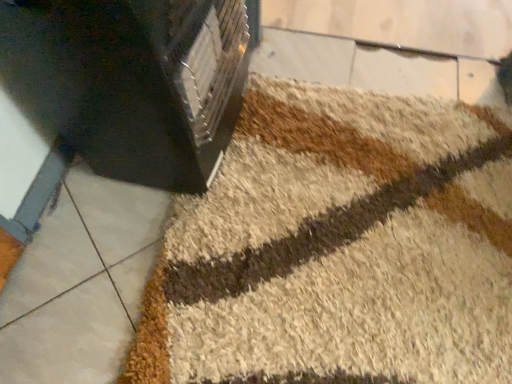
This screenshot has height=384, width=512. In order to click on black plastic heater at upper left in this screenshot , I will do `click(140, 80)`.

Consider the image. Measure the distance between black plastic heater at upper left and camera.

The depth of black plastic heater at upper left is 23.78 inches.

What do you see at coordinates (140, 80) in the screenshot? I see `black plastic heater at upper left` at bounding box center [140, 80].

Describe the element at coordinates (339, 248) in the screenshot. The height and width of the screenshot is (384, 512). I see `beige shaggy bath mat at center` at that location.

The image size is (512, 384). What are the coordinates of `beige shaggy bath mat at center` in the screenshot? It's located at (339, 248).

Find the location of a particular element. The height and width of the screenshot is (384, 512). black plastic heater at upper left is located at coordinates (140, 80).

Between black plastic heater at upper left and beige shaggy bath mat at center, which one appears on the right side from the viewer's perspective?

Positioned to the right is beige shaggy bath mat at center.

Is black plastic heater at upper left in front of beige shaggy bath mat at center?

Yes, it is in front of beige shaggy bath mat at center.

Which is closer to the camera, (169, 163) or (201, 342)?

The point (201, 342) is closer to the camera.

From the image's perspective, relative to beige shaggy bath mat at center, is black plastic heater at upper left above or below?

black plastic heater at upper left is above beige shaggy bath mat at center.

From a real-world perspective, is black plastic heater at upper left above or below beige shaggy bath mat at center?

In terms of real-world spatial position, black plastic heater at upper left is above beige shaggy bath mat at center.

Looking at this image, considering the relative sizes of black plastic heater at upper left and beige shaggy bath mat at center in the image provided, is black plastic heater at upper left thinner than beige shaggy bath mat at center?

Correct, the width of black plastic heater at upper left is less than that of beige shaggy bath mat at center.

Can you confirm if black plastic heater at upper left is shorter than beige shaggy bath mat at center?

No.

Does black plastic heater at upper left have a smaller size compared to beige shaggy bath mat at center?

Actually, black plastic heater at upper left might be larger than beige shaggy bath mat at center.

Would you say beige shaggy bath mat at center is part of black plastic heater at upper left's contents?

Definitely not — beige shaggy bath mat at center is not inside black plastic heater at upper left.

Are black plastic heater at upper left and beige shaggy bath mat at center beside each other?

No, black plastic heater at upper left is not making contact with beige shaggy bath mat at center.

Is black plastic heater at upper left positioned with its back to beige shaggy bath mat at center?

No, black plastic heater at upper left's orientation is not away from beige shaggy bath mat at center.

How different are the orientations of black plastic heater at upper left and beige shaggy bath mat at center in degrees?

They differ by 91.5 degrees in their facing directions.

At what (x,y) coordinates should I click in order to perform the action: click on furniture on the left of beige shaggy bath mat at center. Please return your answer as a coordinate pair (x, y). Looking at the image, I should click on (140, 80).

Is beige shaggy bath mat at center to the left of black plastic heater at upper left from the viewer's perspective?

No, beige shaggy bath mat at center is not to the left of black plastic heater at upper left.

Which is behind, beige shaggy bath mat at center or black plastic heater at upper left?

beige shaggy bath mat at center is further from the camera.

Which is behind, point (436, 348) or point (158, 40)?

The point (436, 348) is farther from the camera.

From the image's perspective, is beige shaggy bath mat at center positioned above or below black plastic heater at upper left?

Clearly, from the image's perspective, beige shaggy bath mat at center is below black plastic heater at upper left.

From a real-world perspective, between beige shaggy bath mat at center and black plastic heater at upper left, who is vertically higher?

black plastic heater at upper left.

Is beige shaggy bath mat at center thinner than black plastic heater at upper left?

Incorrect, the width of beige shaggy bath mat at center is not less than that of black plastic heater at upper left.

Which of these two, beige shaggy bath mat at center or black plastic heater at upper left, stands taller?

black plastic heater at upper left is taller.

Is beige shaggy bath mat at center bigger or smaller than black plastic heater at upper left?

Clearly, beige shaggy bath mat at center is smaller in size than black plastic heater at upper left.

Is beige shaggy bath mat at center situated inside black plastic heater at upper left or outside?

beige shaggy bath mat at center lies outside black plastic heater at upper left.

Are beige shaggy bath mat at center and black plastic heater at upper left making contact?

There is a gap between beige shaggy bath mat at center and black plastic heater at upper left.

Is black plastic heater at upper left at the back of beige shaggy bath mat at center?

No.

What's the angular difference between beige shaggy bath mat at center and black plastic heater at upper left's facing directions?

They differ by 91.5 degrees in their facing directions.

The image size is (512, 384). I want to click on bath mat below the black plastic heater at upper left (from a real-world perspective), so click(x=339, y=248).

In the image, there is a beige shaggy bath mat at center. Where is `furniture above it (from the image's perspective)`? This screenshot has height=384, width=512. furniture above it (from the image's perspective) is located at coordinates (140, 80).

Identify the location of furniture above the beige shaggy bath mat at center (from a real-world perspective). The image size is (512, 384). (140, 80).